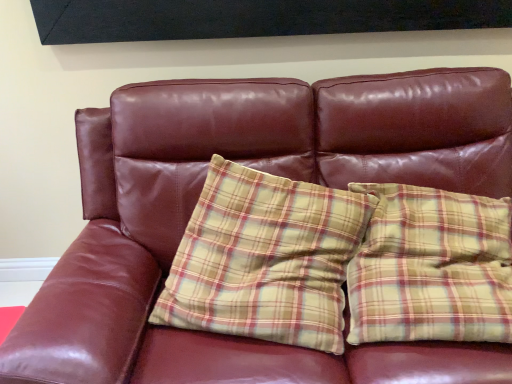
Question: Based on their positions, is yellow plaid pillow at center, acting as the second pillow starting from the right, located to the left or right of yellow plaid pillow at right, positioned as the 1th pillow in right-to-left order?

Choices:
 (A) right
 (B) left

Answer: (B)

Question: In terms of height, does yellow plaid pillow at center, placed as the 1th pillow when sorted from left to right, look taller or shorter compared to yellow plaid pillow at right, which is the second pillow in left-to-right order?

Choices:
 (A) tall
 (B) short

Answer: (A)

Question: From the image's perspective, relative to yellow plaid pillow at right, which is the second pillow in left-to-right order, is yellow plaid pillow at center, acting as the second pillow starting from the right, above or below?

Choices:
 (A) below
 (B) above

Answer: (A)

Question: Based on their positions, is yellow plaid pillow at right, which is the second pillow in left-to-right order, located to the left or right of yellow plaid pillow at center, acting as the second pillow starting from the right?

Choices:
 (A) left
 (B) right

Answer: (B)

Question: From a real-world perspective, relative to yellow plaid pillow at center, placed as the 1th pillow when sorted from left to right, is yellow plaid pillow at right, which is the second pillow in left-to-right order, vertically above or below?

Choices:
 (A) below
 (B) above

Answer: (B)

Question: Choose the correct answer: Is yellow plaid pillow at right, positioned as the 1th pillow in right-to-left order, inside yellow plaid pillow at center, placed as the 1th pillow when sorted from left to right, or outside it?

Choices:
 (A) inside
 (B) outside

Answer: (B)

Question: From the image's perspective, is yellow plaid pillow at right, positioned as the 1th pillow in right-to-left order, located above or below yellow plaid pillow at center, acting as the second pillow starting from the right?

Choices:
 (A) below
 (B) above

Answer: (B)